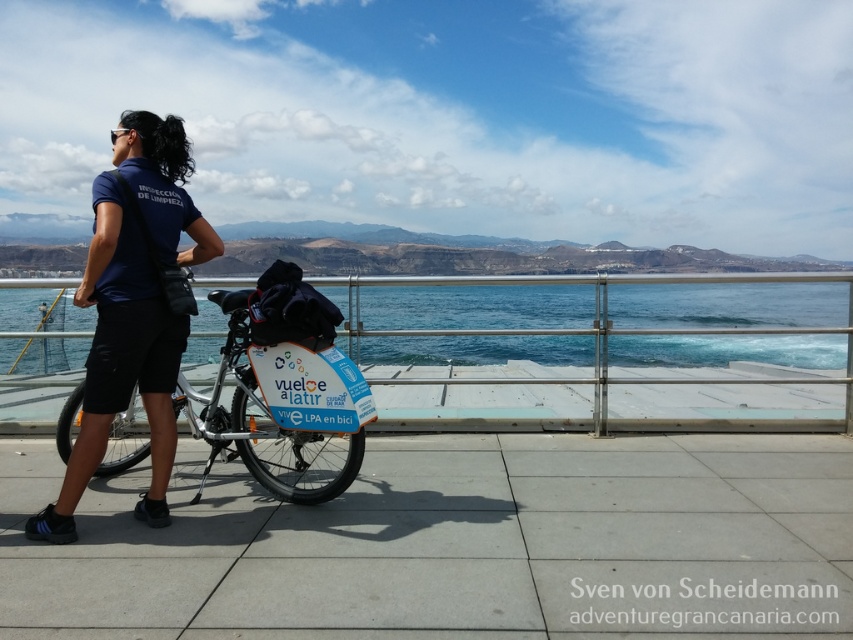
What do you see at coordinates (727, 305) in the screenshot? This screenshot has width=853, height=640. I see `blue water at lower center` at bounding box center [727, 305].

Locate an element on the screen. blue water at lower center is located at coordinates (727, 305).

Is point (675, 353) positioned after point (184, 157)?

Yes, point (675, 353) is behind point (184, 157).

Find the location of `blue water at lower center`. blue water at lower center is located at coordinates (727, 305).

Is blue water at lower center taller than blue matte bicycle at center?

Correct, blue water at lower center is much taller as blue matte bicycle at center.

Is blue water at lower center shorter than blue matte bicycle at center?

In fact, blue water at lower center may be taller than blue matte bicycle at center.

I want to click on blue water at lower center, so click(727, 305).

Is blue fabric shirt at center below blue matte bicycle at center?

Actually, blue fabric shirt at center is above blue matte bicycle at center.

What do you see at coordinates (132, 308) in the screenshot?
I see `blue fabric shirt at center` at bounding box center [132, 308].

Identify the location of blue fabric shirt at center. (132, 308).